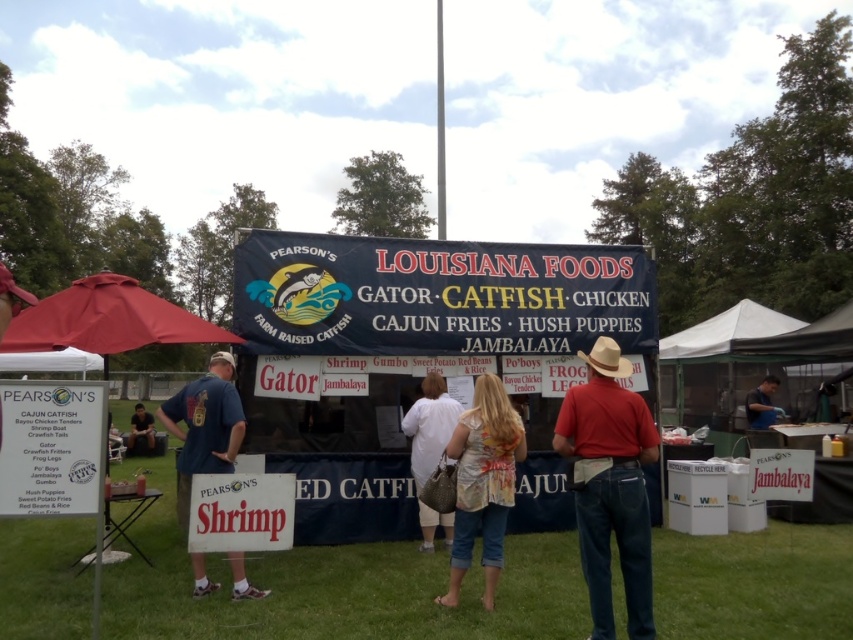
You are a customer at the food stand and want to locate the menu items. Which object, the red fabric canopy at left or the blue shirt at center, is taller?

The red fabric canopy at left is much taller than the blue shirt at center.

You are standing at the center of the food stand and want to locate the red fabric canopy at left. In terms of 2D coordinates, where would you find it?

The red fabric canopy at left is located at coordinates 0.500 in the x axis and 0.125 in the y axis.